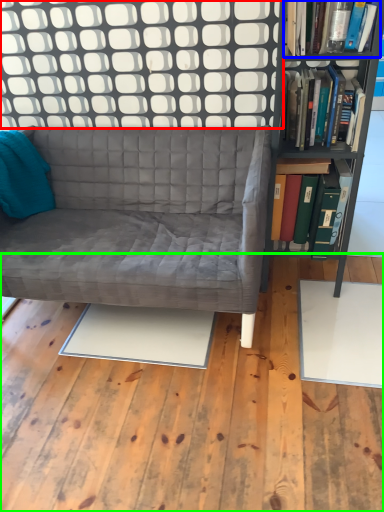
Question: Estimate the real-world distances between objects in this image. Which object is farther from glass door (highlighted by a red box), book (highlighted by a blue box) or plywood (highlighted by a green box)?

Choices:
 (A) book
 (B) plywood

Answer: (B)